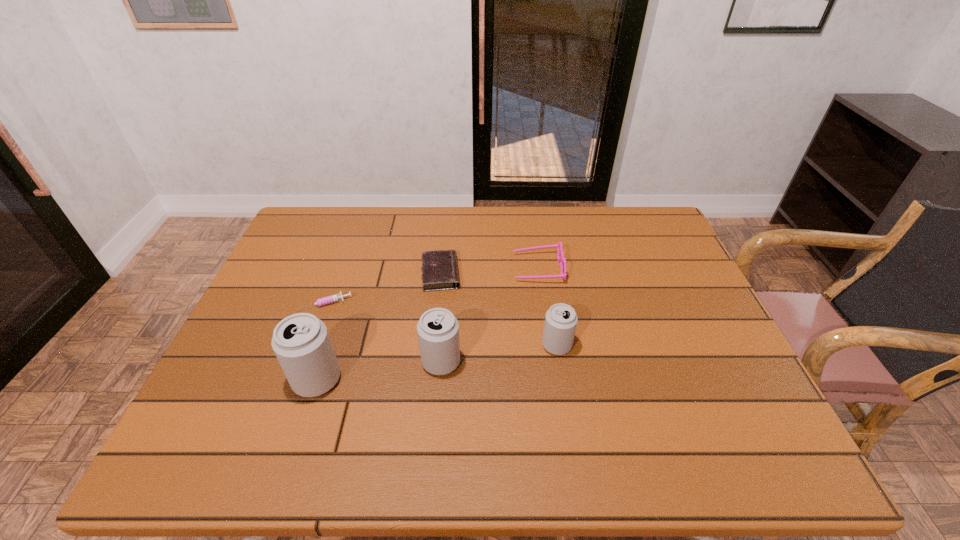
In order to click on the tallest can in this screenshot , I will do `click(301, 342)`.

The height and width of the screenshot is (540, 960). I want to click on the leftmost can, so click(301, 342).

Find the location of a particular element. the fifth shortest object is located at coordinates (438, 329).

Locate an element on the screen. the second can from left to right is located at coordinates (438, 329).

At what (x,y) coordinates should I click in order to perform the action: click on the shortest can. Please return your answer as a coordinate pair (x, y). Image resolution: width=960 pixels, height=540 pixels. Looking at the image, I should click on (560, 324).

You are a GUI agent. You are given a task and a screenshot of the screen. Output one action in this format:
    pyautogui.click(x=<x>, y=<y>)
    Task: Click on the rightmost can
    The image size is (960, 540).
    Given the screenshot: What is the action you would take?
    pyautogui.click(x=560, y=324)

Where is `the third shortest object`? The width and height of the screenshot is (960, 540). the third shortest object is located at coordinates (561, 259).

Locate an element on the screen. This screenshot has width=960, height=540. syringe is located at coordinates (323, 301).

Locate an element on the screen. Image resolution: width=960 pixels, height=540 pixels. the shortest object is located at coordinates coord(323,301).

I want to click on diary, so click(439, 268).